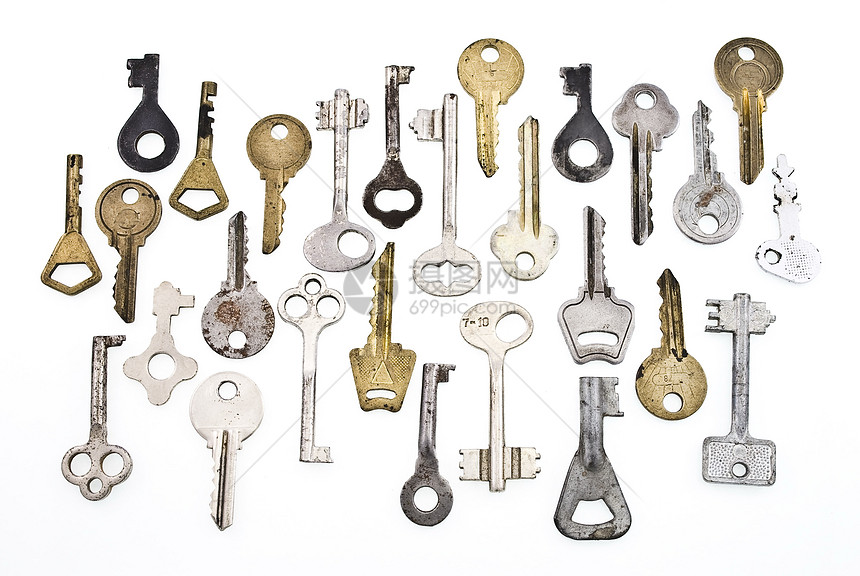
Find the location of a particular element. This screenshot has height=576, width=860. gold colored keys in image is located at coordinates (69, 238), (126, 219), (201, 175), (271, 157), (482, 78), (746, 88), (679, 371), (367, 352).